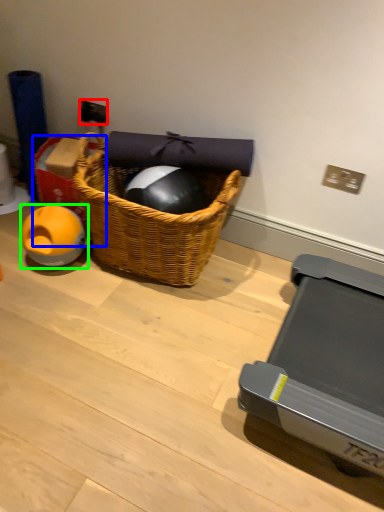
Question: Which object is the farthest from power outlet (highlighted by a red box)? Choose among these: box (highlighted by a blue box) or toy (highlighted by a green box).

Choices:
 (A) box
 (B) toy

Answer: (B)